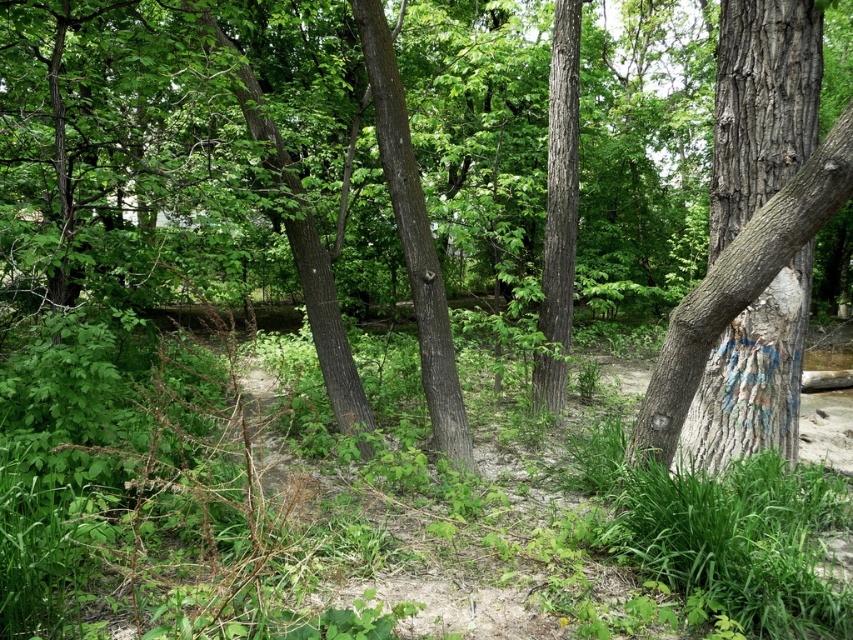
Can you confirm if smooth bark tree trunk at center is smaller than smooth brown tree trunk at center?

Incorrect, smooth bark tree trunk at center is not smaller in size than smooth brown tree trunk at center.

Who is higher up, smooth bark tree trunk at center or smooth brown tree trunk at center?

smooth brown tree trunk at center

You are a GUI agent. You are given a task and a screenshot of the screen. Output one action in this format:
    pyautogui.click(x=<x>, y=<y>)
    Task: Click on the smooth bark tree trunk at center
    This screenshot has height=640, width=853.
    Given the screenshot: What is the action you would take?
    pyautogui.click(x=415, y=237)

Where is `smooth bark tree trunk at center`? The image size is (853, 640). smooth bark tree trunk at center is located at coordinates (415, 237).

Locate an element on the screen. This screenshot has height=640, width=853. smooth gray bark tree at right is located at coordinates 752,244.

Is smooth gray bark tree at right below smooth brown tree trunk at center?

Indeed, smooth gray bark tree at right is positioned under smooth brown tree trunk at center.

Measure the distance between point (x=798, y=145) and camera.

A distance of 16.84 feet exists between point (x=798, y=145) and camera.

You are a GUI agent. You are given a task and a screenshot of the screen. Output one action in this format:
    pyautogui.click(x=<x>, y=<y>)
    Task: Click on the smooth gray bark tree at right
    
    Given the screenshot: What is the action you would take?
    pyautogui.click(x=752, y=244)

Looking at this image, between smooth gray bark tree at right and smooth bark tree trunk at center, which one appears on the right side from the viewer's perspective?

smooth gray bark tree at right

Between point (717, 193) and point (387, 122), which one is positioned in front?

Point (717, 193)

Find the location of `smooth gray bark tree at right`. smooth gray bark tree at right is located at coordinates (752, 244).